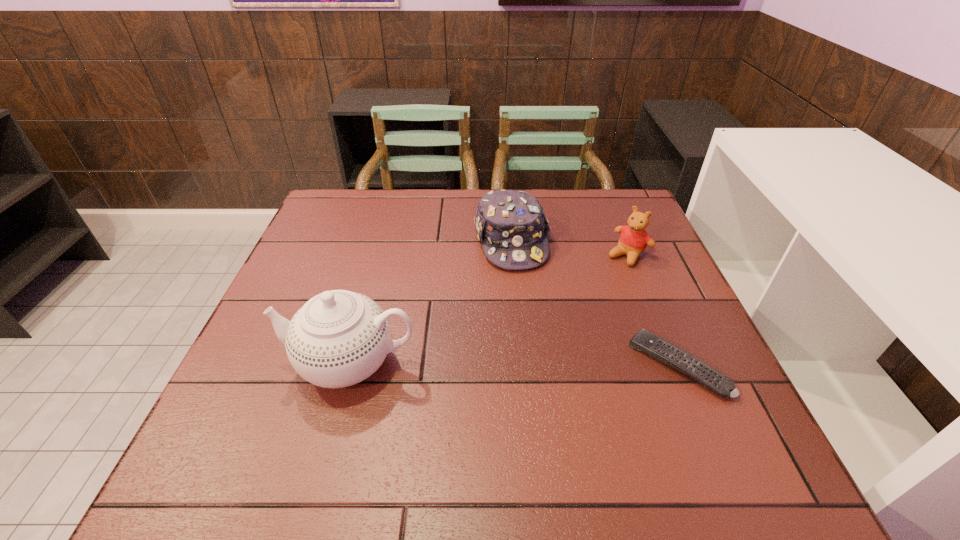
You are a GUI agent. You are given a task and a screenshot of the screen. Output one action in this format:
    pyautogui.click(x=<x>, y=<y>)
    Task: Click on the tallest object
    The width and height of the screenshot is (960, 540).
    Given the screenshot: What is the action you would take?
    339,338

At what (x,y) coordinates should I click in order to perform the action: click on the leftmost object. Please return your answer as a coordinate pair (x, y). Image resolution: width=960 pixels, height=540 pixels. Looking at the image, I should click on (339, 338).

Image resolution: width=960 pixels, height=540 pixels. Identify the location of the shortest object. (658, 348).

Identify the location of headwear. (511, 225).

This screenshot has height=540, width=960. Find the location of `teddy bear`. teddy bear is located at coordinates (634, 239).

Where is `vacant space positioned 0.070m on the spout of the tallest object`? The height and width of the screenshot is (540, 960). vacant space positioned 0.070m on the spout of the tallest object is located at coordinates (251, 362).

Locate an element on the screen. The height and width of the screenshot is (540, 960). free spot located on the left of the remote control is located at coordinates (450, 365).

You are a GUI agent. You are given a task and a screenshot of the screen. Output one action in this format:
    pyautogui.click(x=<x>, y=<y>)
    Task: Click on the vacant area situated on the front-facing side of the second object from left to right
    The height and width of the screenshot is (540, 960).
    Given the screenshot: What is the action you would take?
    click(x=557, y=373)

At what (x,y) coordinates should I click in order to perform the action: click on free space located 0.190m on the front-facing side of the second object from left to right. Please return your answer as a coordinate pair (x, y). Image resolution: width=960 pixels, height=540 pixels. Looking at the image, I should click on (540, 326).

Locate an element on the screen. free space located 0.380m on the front-facing side of the second object from left to right is located at coordinates (565, 398).